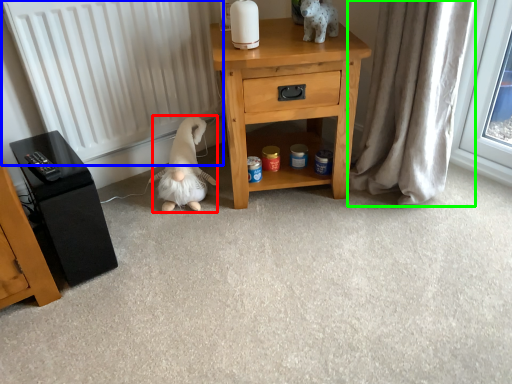
Question: Considering the real-world distances, which object is closest to animal (highlighted by a red box)? radiator (highlighted by a blue box) or curtain (highlighted by a green box).

Choices:
 (A) radiator
 (B) curtain

Answer: (A)